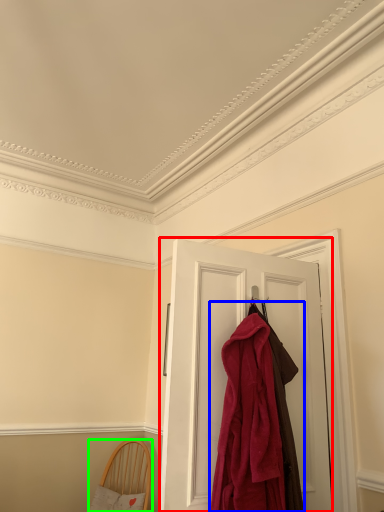
Question: Which is nearer to the door (highlighted by a red box)? cloak (highlighted by a blue box) or furniture (highlighted by a green box).

Choices:
 (A) cloak
 (B) furniture

Answer: (A)